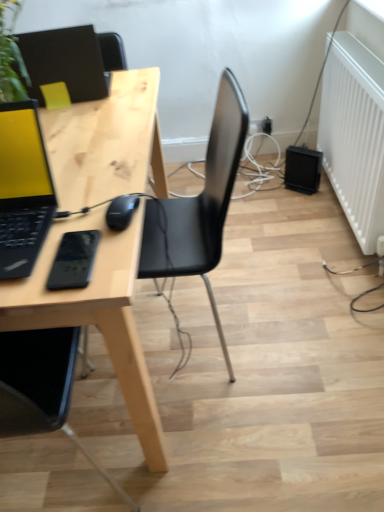
Question: From a real-world perspective, is white matte radiator at right beneath matte black laptop at upper left, placed as the second laptop when sorted from bottom to top?

Choices:
 (A) no
 (B) yes

Answer: (B)

Question: Is white matte radiator at right looking in the opposite direction of matte black laptop at upper left, placed as the second laptop when sorted from bottom to top?

Choices:
 (A) no
 (B) yes

Answer: (A)

Question: Considering the relative positions of white matte radiator at right and matte black laptop at upper left, the second laptop in the front-to-back sequence, in the image provided, is white matte radiator at right to the right of matte black laptop at upper left, the second laptop in the front-to-back sequence, from the viewer's perspective?

Choices:
 (A) yes
 (B) no

Answer: (A)

Question: Considering the relative sizes of white matte radiator at right and matte black laptop at upper left, arranged as the 1th laptop when viewed from the back, in the image provided, is white matte radiator at right thinner than matte black laptop at upper left, arranged as the 1th laptop when viewed from the back,?

Choices:
 (A) no
 (B) yes

Answer: (B)

Question: Is white matte radiator at right shorter than matte black laptop at upper left, the second laptop in the front-to-back sequence?

Choices:
 (A) yes
 (B) no

Answer: (B)

Question: From the image's perspective, is white matte radiator at right beneath matte black laptop at upper left, placed as the second laptop when sorted from bottom to top?

Choices:
 (A) yes
 (B) no

Answer: (A)

Question: From a real-world perspective, is light wood desk at center over black plastic speaker at lower right?

Choices:
 (A) no
 (B) yes

Answer: (B)

Question: Is light wood desk at center positioned far away from black plastic speaker at lower right?

Choices:
 (A) no
 (B) yes

Answer: (B)

Question: Is light wood desk at center next to black plastic speaker at lower right and touching it?

Choices:
 (A) no
 (B) yes

Answer: (A)

Question: Does light wood desk at center appear on the right side of black plastic speaker at lower right?

Choices:
 (A) yes
 (B) no

Answer: (B)

Question: From the image's perspective, is light wood desk at center below black plastic speaker at lower right?

Choices:
 (A) yes
 (B) no

Answer: (A)

Question: Can you confirm if light wood desk at center is smaller than black plastic speaker at lower right?

Choices:
 (A) no
 (B) yes

Answer: (A)

Question: Considering the relative sizes of black matte mouse at center and matte black laptop at left, which appears as the first laptop when viewed from the front, in the image provided, is black matte mouse at center thinner than matte black laptop at left, which appears as the first laptop when viewed from the front,?

Choices:
 (A) no
 (B) yes

Answer: (B)